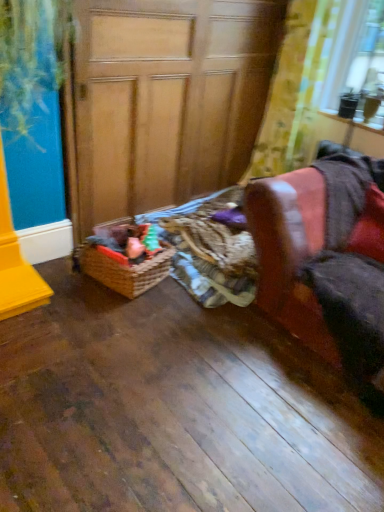
Question: Is woven brown basket at lower center inside or outside of yellow floral fabric at upper right?

Choices:
 (A) inside
 (B) outside

Answer: (B)

Question: Considering their positions, is woven brown basket at lower center located in front of or behind yellow floral fabric at upper right?

Choices:
 (A) behind
 (B) front

Answer: (B)

Question: Which object is the closest to the wooden at left?

Choices:
 (A) leather armchair at right
 (B) woven brown basket at lower center
 (C) yellow floral fabric at upper right

Answer: (C)

Question: Estimate the real-world distances between objects in this image. Which object is farther from the yellow floral fabric at upper right?

Choices:
 (A) wooden at left
 (B) leather armchair at right
 (C) woven brown basket at lower center

Answer: (C)